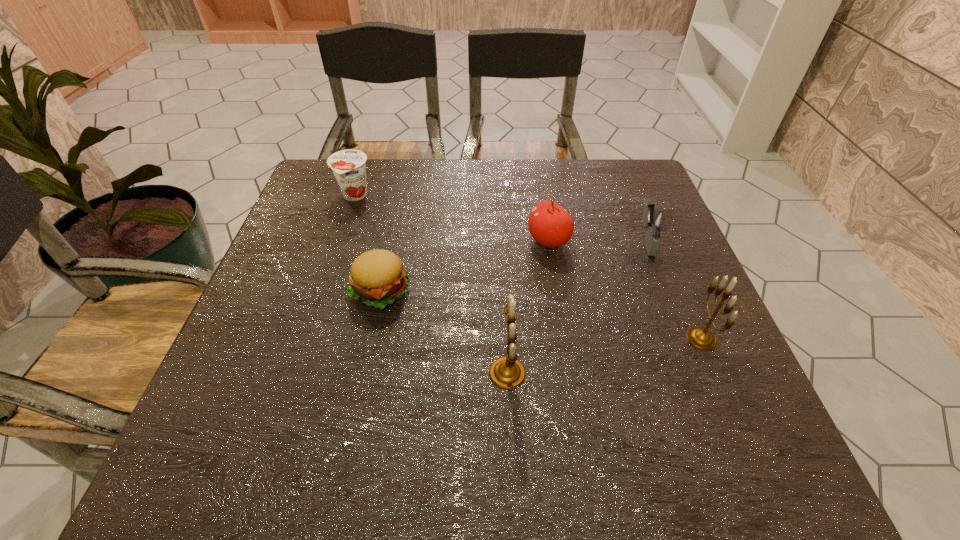
In order to click on object identified as the third closest to the taller candelabrum in this screenshot , I will do `click(702, 338)`.

Find the location of a particular element. This screenshot has width=960, height=540. free space that satisfies the following two spatial constraints: 1. on the front side of the igniter; 2. on the left side of the second tallest object is located at coordinates (684, 338).

Locate an element on the screen. The image size is (960, 540). free point that satisfies the following two spatial constraints: 1. on the back side of the fourth object from left to right; 2. on the right side of the left candelabrum is located at coordinates (501, 241).

Locate an element on the screen. The height and width of the screenshot is (540, 960). vacant region that satisfies the following two spatial constraints: 1. on the front side of the shorter candelabrum; 2. on the right side of the third object from right to left is located at coordinates (564, 338).

At what (x,y) coordinates should I click in order to perform the action: click on blank space that satisfies the following two spatial constraints: 1. on the back side of the tallest object; 2. on the right side of the third object from right to left. Please return your answer as a coordinate pair (x, y). This screenshot has width=960, height=540. Looking at the image, I should click on (501, 241).